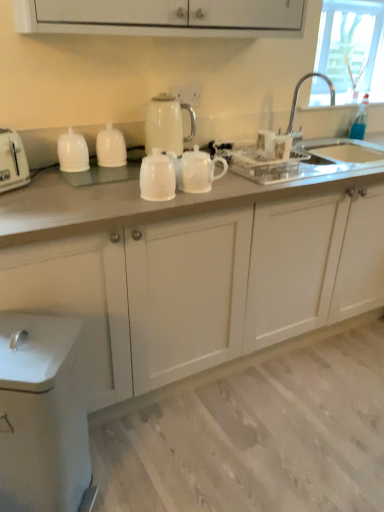
Question: Considering the relative sizes of silver metallic faucet at upper right and white glossy electric kettle at upper center in the image provided, is silver metallic faucet at upper right shorter than white glossy electric kettle at upper center?

Choices:
 (A) yes
 (B) no

Answer: (B)

Question: Could white glossy electric kettle at upper center be considered to be inside silver metallic faucet at upper right?

Choices:
 (A) yes
 (B) no

Answer: (B)

Question: Is silver metallic faucet at upper right turned away from white glossy electric kettle at upper center?

Choices:
 (A) yes
 (B) no

Answer: (B)

Question: From the image's perspective, is silver metallic faucet at upper right below white glossy electric kettle at upper center?

Choices:
 (A) yes
 (B) no

Answer: (B)

Question: Can you confirm if silver metallic faucet at upper right is wider than white glossy electric kettle at upper center?

Choices:
 (A) yes
 (B) no

Answer: (A)

Question: Would you say white glossy teapot at center is inside or outside white glossy teapot at center, which is the 2th tableware from right to left?

Choices:
 (A) outside
 (B) inside

Answer: (A)

Question: From the image's perspective, is white glossy teapot at center located above or below white glossy teapot at center, which is the 2th tableware from right to left?

Choices:
 (A) below
 (B) above

Answer: (A)

Question: Is white glossy teapot at center to the left or to the right of white glossy teapot at center, the 2th tableware positioned from the left, in the image?

Choices:
 (A) right
 (B) left

Answer: (A)

Question: From a real-world perspective, is white glossy teapot at center above or below white glossy teapot at center, the 2th tableware positioned from the left?

Choices:
 (A) above
 (B) below

Answer: (A)

Question: Based on their sizes in the image, would you say white plastic toaster at left is bigger or smaller than white glossy teapot at center, which is the 2th tableware from right to left?

Choices:
 (A) big
 (B) small

Answer: (A)

Question: In terms of height, does white plastic toaster at left look taller or shorter compared to white glossy teapot at center, which is the 2th tableware from right to left?

Choices:
 (A) short
 (B) tall

Answer: (B)

Question: In the image, is white plastic toaster at left positioned in front of or behind white glossy teapot at center, which is the 2th tableware from right to left?

Choices:
 (A) behind
 (B) front

Answer: (B)

Question: Is white plastic toaster at left wider or thinner than white glossy teapot at center, which is the 2th tableware from right to left?

Choices:
 (A) thin
 (B) wide

Answer: (B)

Question: From the image's perspective, is blue glass bottle at upper right positioned above or below white glossy teapot at center?

Choices:
 (A) below
 (B) above

Answer: (B)

Question: Relative to white glossy teapot at center, is blue glass bottle at upper right in front or behind?

Choices:
 (A) behind
 (B) front

Answer: (A)